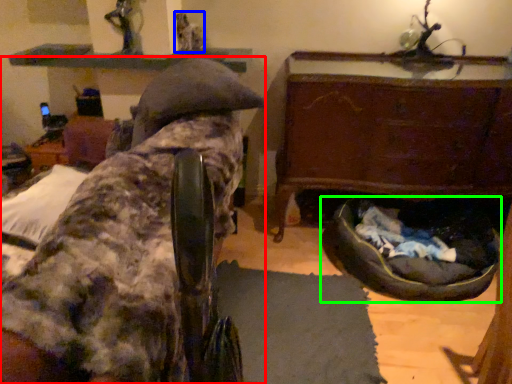
Question: Which object is positioned closest to furniture (highlighted by a red box)? Select from person (highlighted by a blue box) and dog bed (highlighted by a green box).

Choices:
 (A) person
 (B) dog bed

Answer: (B)